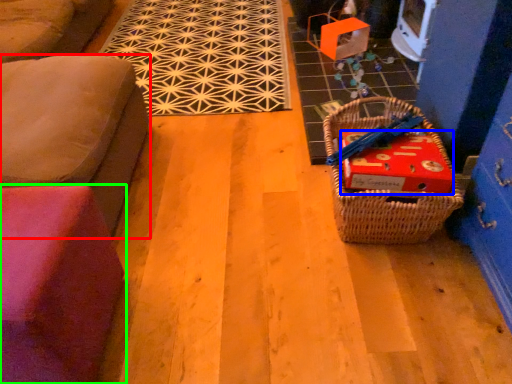
Question: Which object is positioned closest to furniture (highlighted by a red box)? Select from cardboard box (highlighted by a blue box) and furniture (highlighted by a green box).

Choices:
 (A) cardboard box
 (B) furniture

Answer: (B)